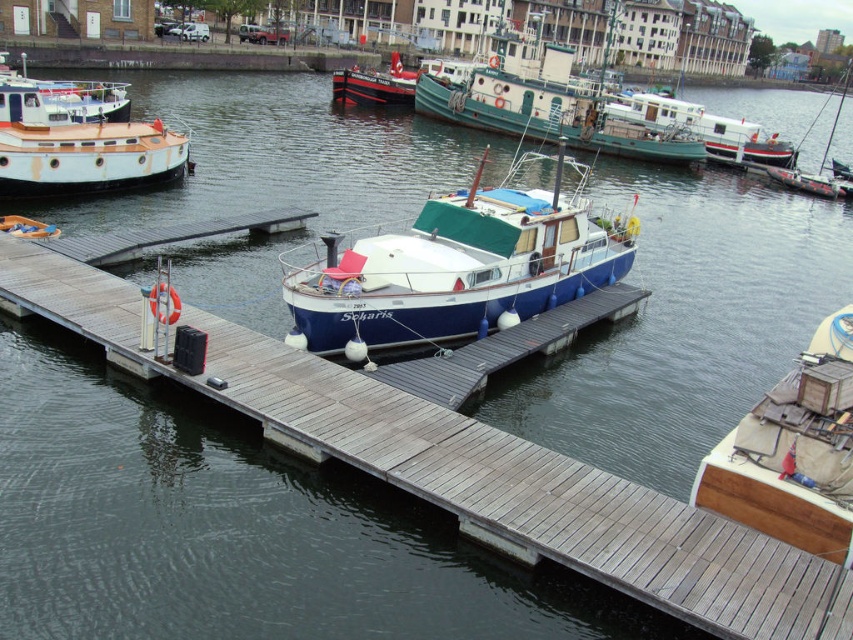
Question: Does red polished wood boat at center come in front of black matte sailboat at upper right?

Choices:
 (A) no
 (B) yes

Answer: (A)

Question: Which object is farther from the camera taking this photo?

Choices:
 (A) wooden deck at center
 (B) white matte houseboat at right

Answer: (B)

Question: Which object is positioned farthest from the red polished wood boat at center?

Choices:
 (A) blue matte boat at center
 (B) white matte houseboat at right
 (C) wooden deck at center
 (D) white wooden boat at left

Answer: (C)

Question: Can you confirm if white matte houseboat at right is wider than black matte sailboat at upper right?

Choices:
 (A) no
 (B) yes

Answer: (A)

Question: Which object is positioned farthest from the white matte houseboat at right?

Choices:
 (A) wooden dock at center
 (B) wooden deck at center
 (C) black matte sailboat at upper right

Answer: (B)

Question: Is white matte houseboat at right to the right of red polished wood boat at center from the viewer's perspective?

Choices:
 (A) no
 (B) yes

Answer: (B)